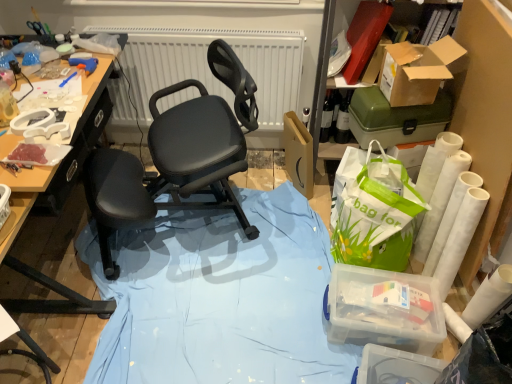
At what (x,y) coordinates should I click in order to perform the action: click on clear plastic container at lower right, the third box viewed from the top. Please return your answer as a coordinate pair (x, y). Looking at the image, I should click on (383, 310).

Where is `matte black bottle at upper right`? The height and width of the screenshot is (384, 512). matte black bottle at upper right is located at coordinates (343, 120).

This screenshot has width=512, height=384. What are the coordinates of `white matte radiator at upper center` in the screenshot? It's located at (209, 68).

Find the location of a particular element. This screenshot has height=384, width=512. clear plastic container at lower right, the second box in the bottom-to-top sequence is located at coordinates (383, 310).

Is the depth of matte blue glue gun at upper left less than that of green plastic toolbox at upper right, positioned as the 3th box in bottom-to-top order?

Yes, matte blue glue gun at upper left is in front of green plastic toolbox at upper right, positioned as the 3th box in bottom-to-top order.

Considering the relative positions of matte blue glue gun at upper left and green plastic toolbox at upper right, which is the second box in top-to-bottom order, in the image provided, is matte blue glue gun at upper left to the left or to the right of green plastic toolbox at upper right, which is the second box in top-to-bottom order,?

matte blue glue gun at upper left is to the left of green plastic toolbox at upper right, which is the second box in top-to-bottom order.

Considering the sizes of objects matte blue glue gun at upper left and green plastic toolbox at upper right, positioned as the 3th box in bottom-to-top order, in the image provided, who is thinner, matte blue glue gun at upper left or green plastic toolbox at upper right, positioned as the 3th box in bottom-to-top order,?

Thinner between the two is matte blue glue gun at upper left.

Between cardboard box at upper right, which is the 4th box from bottom to top, and white matte radiator at upper center, which one has more height?

With more height is white matte radiator at upper center.

Which is more to the left, cardboard box at upper right, which is the 4th box from bottom to top, or white matte radiator at upper center?

Positioned to the left is white matte radiator at upper center.

Does cardboard box at upper right, the first box from the top, come behind white matte radiator at upper center?

No.

Is cardboard box at upper right, which is the 4th box from bottom to top, bigger than white matte radiator at upper center?

Actually, cardboard box at upper right, which is the 4th box from bottom to top, might be smaller than white matte radiator at upper center.

Measure the distance between matte black bottle at upper right and white plastic tray at upper left.

The distance of matte black bottle at upper right from white plastic tray at upper left is 4.13 feet.

Can you confirm if matte black bottle at upper right is wider than white plastic tray at upper left?

Yes, matte black bottle at upper right is wider than white plastic tray at upper left.

Who is more distant, matte black bottle at upper right or white plastic tray at upper left?

Positioned behind is matte black bottle at upper right.

Is matte black bottle at upper right oriented towards white plastic tray at upper left?

No, matte black bottle at upper right is not aimed at white plastic tray at upper left.

At what (x,y) coordinates should I click in order to perform the action: click on radiator that appears above the blue matte fabric at center (from the image's perspective). Please return your answer as a coordinate pair (x, y). Looking at the image, I should click on point(209,68).

Does point (205, 77) appear closer or farther from the camera than point (197, 362)?

Point (205, 77).

Considering the positions of objects white matte radiator at upper center and blue matte fabric at center in the image provided, who is more to the right, white matte radiator at upper center or blue matte fabric at center?

From the viewer's perspective, blue matte fabric at center appears more on the right side.

From the image's perspective, which object appears higher, white matte radiator at upper center or blue matte fabric at center?

white matte radiator at upper center.

Considering their positions, is transparent plastic container at lower right, marked as the 1th box in a bottom-to-top arrangement, located in front of or behind clear plastic container at lower right, the second box in the bottom-to-top sequence?

transparent plastic container at lower right, marked as the 1th box in a bottom-to-top arrangement, is positioned closer to the viewer than clear plastic container at lower right, the second box in the bottom-to-top sequence.

Is there a large distance between transparent plastic container at lower right, marked as the 1th box in a bottom-to-top arrangement, and clear plastic container at lower right, the third box viewed from the top?

transparent plastic container at lower right, marked as the 1th box in a bottom-to-top arrangement, is actually quite close to clear plastic container at lower right, the third box viewed from the top.

Which is more to the left, transparent plastic container at lower right, which appears as the fourth box when viewed from the top, or clear plastic container at lower right, the second box in the bottom-to-top sequence?

clear plastic container at lower right, the second box in the bottom-to-top sequence.

Does point (382, 360) appear closer or farther from the camera than point (411, 296)?

Point (382, 360).

Which point is more forward, (231,297) or (149,65)?

Point (231,297)

Are blue matte fabric at center and white matte radiator at upper center making contact?

blue matte fabric at center is not next to white matte radiator at upper center, and they're not touching.

Which object is more forward, blue matte fabric at center or white matte radiator at upper center?

blue matte fabric at center is in front.

Considering the sizes of blue matte fabric at center and white matte radiator at upper center in the image, is blue matte fabric at center bigger or smaller than white matte radiator at upper center?

blue matte fabric at center is bigger than white matte radiator at upper center.

Is green plastic toolbox at upper right, which is the second box in top-to-bottom order, bigger than blue matte fabric at center?

Actually, green plastic toolbox at upper right, which is the second box in top-to-bottom order, might be smaller than blue matte fabric at center.

What's the angular difference between green plastic toolbox at upper right, which is the second box in top-to-bottom order, and blue matte fabric at center's facing directions?

There is a 91.9-degree angle between the facing directions of green plastic toolbox at upper right, which is the second box in top-to-bottom order, and blue matte fabric at center.

Is green plastic toolbox at upper right, which is the second box in top-to-bottom order, not inside blue matte fabric at center?

green plastic toolbox at upper right, which is the second box in top-to-bottom order, lies outside blue matte fabric at center's area.

The width and height of the screenshot is (512, 384). There is a matte blue glue gun at upper left. In order to click on the 1st box below it (from a real-world perspective) in this screenshot , I will do `click(396, 118)`.

Which box is the 4th one when counting from the right side of the white matte radiator at upper center? Please provide its 2D coordinates.

[(420, 70)]

Considering their positions, is white matte radiator at upper center positioned further to matte blue glue gun at upper left than transparent plastic container at lower right, which appears as the fourth box when viewed from the top?

transparent plastic container at lower right, which appears as the fourth box when viewed from the top, is positioned further to the anchor matte blue glue gun at upper left.

When comparing their distances from white matte radiator at upper center, does green plastic toolbox at upper right, positioned as the 3th box in bottom-to-top order, or transparent plastic container at lower right, which appears as the fourth box when viewed from the top, seem closer?

green plastic toolbox at upper right, positioned as the 3th box in bottom-to-top order, lies closer to white matte radiator at upper center than the other object.

From the image, which object appears to be nearer to white plastic tray at upper left, green plastic toolbox at upper right, positioned as the 3th box in bottom-to-top order, or cardboard box at upper right, which is the 4th box from bottom to top?

The object closer to white plastic tray at upper left is green plastic toolbox at upper right, positioned as the 3th box in bottom-to-top order.

Considering their positions, is matte blue glue gun at upper left positioned further to green plastic toolbox at upper right, positioned as the 3th box in bottom-to-top order, than transparent plastic container at lower right, marked as the 1th box in a bottom-to-top arrangement?

matte blue glue gun at upper left.

When comparing their distances from clear plastic container at lower right, the second box in the bottom-to-top sequence, does white plastic tray at upper left or matte black bottle at upper right seem further?

The object further to clear plastic container at lower right, the second box in the bottom-to-top sequence, is white plastic tray at upper left.

Which object lies nearer to the anchor point black mesh chair at center, white plastic tray at upper left or white matte radiator at upper center?

white matte radiator at upper center lies closer to black mesh chair at center than the other object.

Considering their positions, is white plastic tray at upper left positioned further to clear plastic container at lower right, the second box in the bottom-to-top sequence, than black mesh chair at center?

The object further to clear plastic container at lower right, the second box in the bottom-to-top sequence, is white plastic tray at upper left.

From the image, which object appears to be farther from black mesh chair at center, matte blue glue gun at upper left or white plastic tray at upper left?

matte blue glue gun at upper left lies further to black mesh chair at center than the other object.

The height and width of the screenshot is (384, 512). I want to click on chair between matte black bottle at upper right and transparent plastic container at lower right, which appears as the fourth box when viewed from the top, in the up-down direction, so click(x=168, y=167).

This screenshot has height=384, width=512. Find the location of `fabric located between white plastic tray at upper left and matte black bottle at upper right in the left-right direction`. fabric located between white plastic tray at upper left and matte black bottle at upper right in the left-right direction is located at coordinates (220, 298).

The height and width of the screenshot is (384, 512). What are the coordinates of `bottle situated between matte blue glue gun at upper left and clear plastic container at lower right, the third box viewed from the top, from left to right` in the screenshot? It's located at (343, 120).

Identify the location of radiator between matte blue glue gun at upper left and cardboard box at upper right, which is the 4th box from bottom to top. Image resolution: width=512 pixels, height=384 pixels. (209, 68).